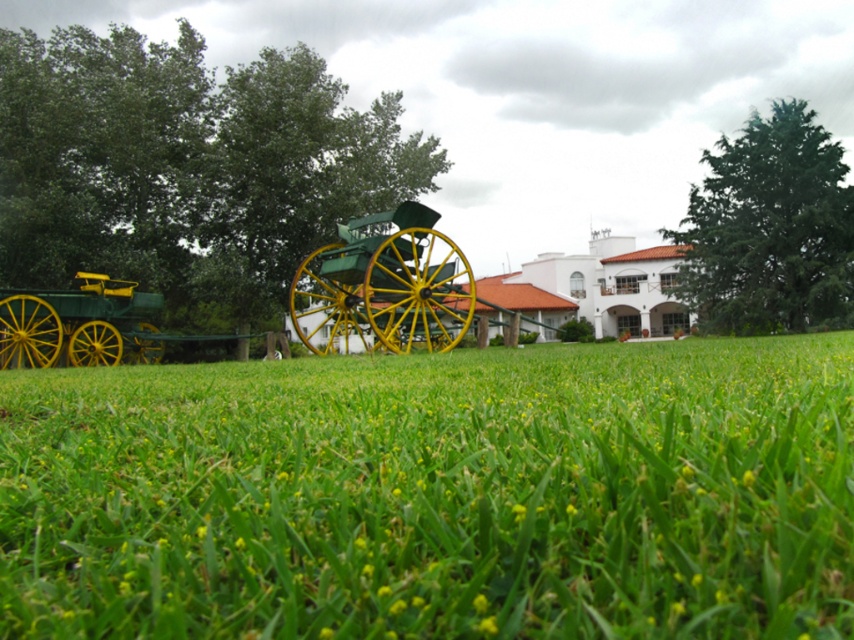
You are standing in the outdoor scene and want to place a small yellow flower from the green grass at center onto the green polished wood wagon at center. Is the wagon positioned above or below the grass where the flower is located?

The green grass at center is below the green polished wood wagon at center, so the wagon is positioned above the grass where the flower is located.

You are a gardener planning to plant a new flower bed. You observe the green grass at center and the green matte wagon at left in the scene. Which area would be more suitable for planting, and why?

The green grass at center is more suitable for planting because it has a smaller size compared to the green matte wagon at left, making it a better area for flowers.

You are a delivery person who needs to choose between two wagons to transport a large package. The green polished wood wagon at center and the green matte wagon at left are available. Which wagon should you choose based on their sizes?

The green polished wood wagon at center is bigger than the green matte wagon at left, so you should choose the green polished wood wagon at center to transport the large package.